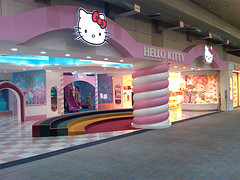
Locate an element on the screen. poster on wall is located at coordinates coord(27,87).